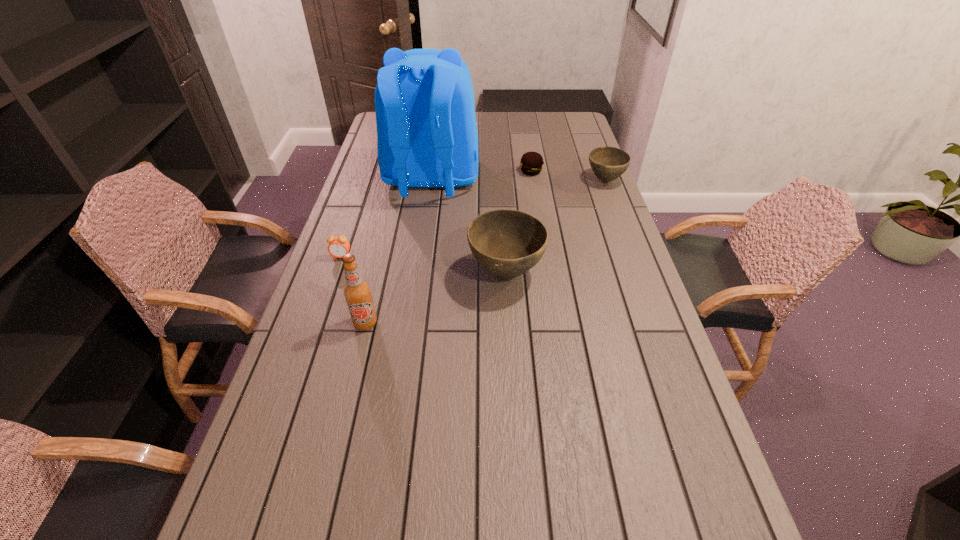
Locate an element on the screen. This screenshot has width=960, height=540. the taller bowl is located at coordinates (507, 243).

Identify the location of the nearer bowl. (507, 243).

What are the coordinates of `the farther bowl` in the screenshot? It's located at (608, 163).

Where is `the shorter bowl`? the shorter bowl is located at coordinates (608, 163).

This screenshot has width=960, height=540. In order to click on the tallest object in this screenshot , I will do `click(427, 137)`.

I want to click on the shortest object, so click(531, 163).

The image size is (960, 540). What are the coordinates of `beer bottle` in the screenshot? It's located at (357, 292).

You are a GUI agent. You are given a task and a screenshot of the screen. Output one action in this format:
    pyautogui.click(x=<x>, y=<y>)
    Task: Click on the fifth shortest object
    
    Given the screenshot: What is the action you would take?
    pyautogui.click(x=357, y=292)

At what (x,y) coordinates should I click in order to perform the action: click on the leftmost object. Please return your answer as a coordinate pair (x, y). The width and height of the screenshot is (960, 540). Looking at the image, I should click on (338, 246).

Where is `free point located on the right of the nearer bowl`? This screenshot has height=540, width=960. free point located on the right of the nearer bowl is located at coordinates (598, 273).